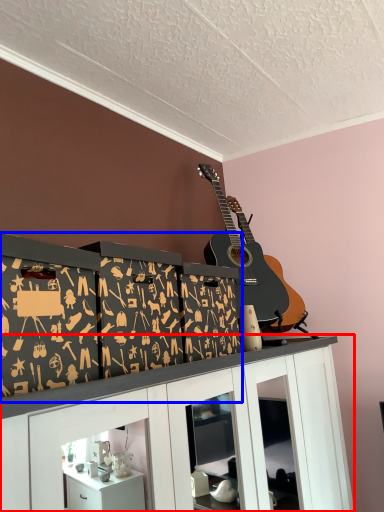
Question: Which of the following is the closest to the observer, cabinetry (highlighted by a red box) or shelf (highlighted by a blue box)?

Choices:
 (A) cabinetry
 (B) shelf

Answer: (A)